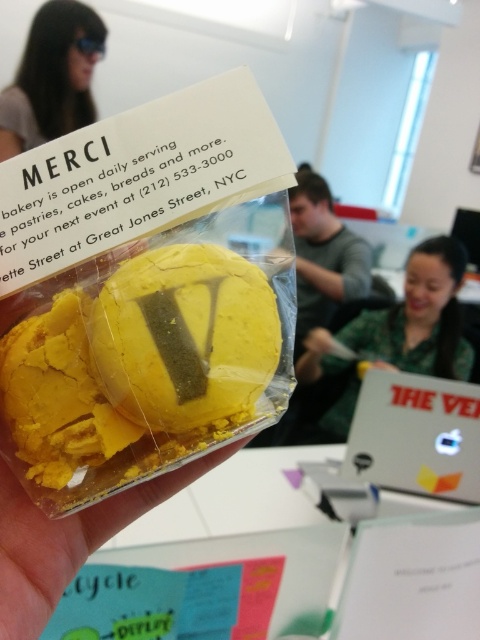
Question: Which point is closer to the camera taking this photo?

Choices:
 (A) (60, 8)
 (B) (327, 260)
 (C) (75, 284)

Answer: (C)

Question: Which object is positioned farthest from the green matte shirt at center?

Choices:
 (A) yellow crumbly pastry at center
 (B) green fabric shirt at upper center

Answer: (A)

Question: Does yellow crumbly pastry at center lie behind matte black sunglasses at upper left?

Choices:
 (A) no
 (B) yes

Answer: (A)

Question: Which of the following is the farthest from the observer?

Choices:
 (A) yellow crumbly pastry at center
 (B) matte black sunglasses at upper left
 (C) green matte shirt at center

Answer: (B)

Question: Does yellow crumbly pastry at center have a lesser width compared to green matte shirt at center?

Choices:
 (A) yes
 (B) no

Answer: (A)

Question: In this image, where is yellow crumbly pastry at center located relative to green matte shirt at center?

Choices:
 (A) below
 (B) above

Answer: (B)